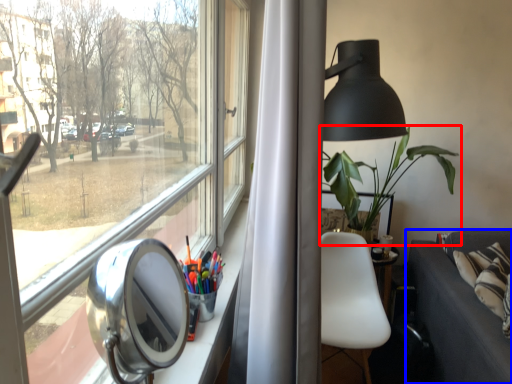
Question: Among these objects, which one is farthest to the camera, houseplant (highlighted by a red box) or studio couch (highlighted by a blue box)?

Choices:
 (A) houseplant
 (B) studio couch

Answer: (A)